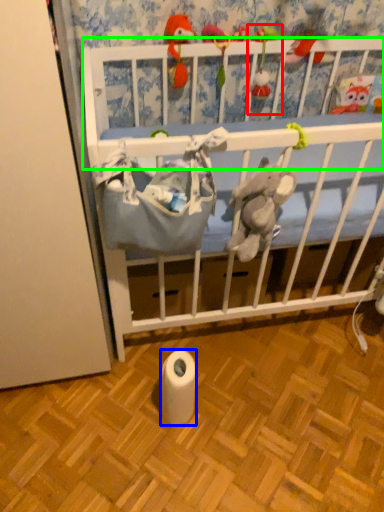
Question: Which is farther away from toy (highlighted by a red box)? toilet paper (highlighted by a blue box) or infant bed (highlighted by a green box)?

Choices:
 (A) toilet paper
 (B) infant bed

Answer: (A)